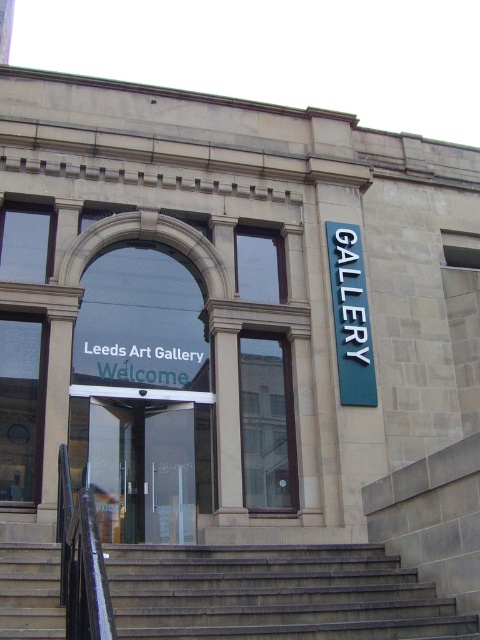
Is the position of transparent glass door at center less distant than that of blue metallic sign at upper right?

That is True.

Between transparent glass door at center and blue metallic sign at upper right, which one has more height?

blue metallic sign at upper right

Which is in front, point (151, 492) or point (349, 397)?

Point (151, 492) is more forward.

At what (x,y) coordinates should I click in order to perform the action: click on transparent glass door at center. Please return your answer as a coordinate pair (x, y). The width and height of the screenshot is (480, 640). Looking at the image, I should click on (143, 470).

Is point (284, 589) positioned behind point (336, 337)?

No, it is not.

I want to click on gray concrete stairs at center, so click(275, 595).

Which is behind, point (196, 628) or point (110, 486)?

The point (110, 486) is more distant.

Which is in front, point (126, 560) or point (180, 426)?

Point (126, 560) is in front.

Identify the location of gray concrete stairs at center. The width and height of the screenshot is (480, 640). (275, 595).